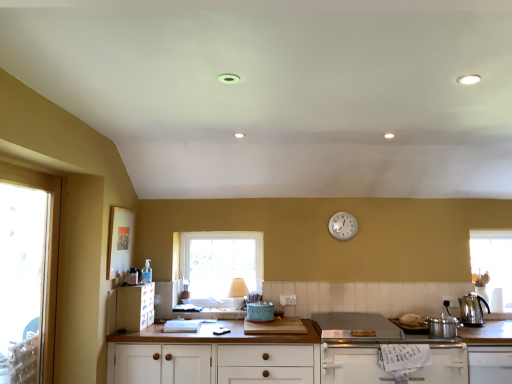
Question: Is teal ceramic toaster at center, which is counted as the first appliance, starting from the back, at the left side of matte plastic cabinet at lower left, the first cabinetry positioned from the left?

Choices:
 (A) no
 (B) yes

Answer: (A)

Question: Considering the relative sizes of teal ceramic toaster at center, the 2th appliance in the right-to-left sequence, and matte plastic cabinet at lower left, marked as the 4th cabinetry in a right-to-left arrangement, in the image provided, is teal ceramic toaster at center, the 2th appliance in the right-to-left sequence, smaller than matte plastic cabinet at lower left, marked as the 4th cabinetry in a right-to-left arrangement,?

Choices:
 (A) yes
 (B) no

Answer: (A)

Question: Does teal ceramic toaster at center, the 2th appliance in the right-to-left sequence, have a larger size compared to matte plastic cabinet at lower left, the first cabinetry positioned from the left?

Choices:
 (A) yes
 (B) no

Answer: (B)

Question: Does teal ceramic toaster at center, the 2th appliance from the front, have a lesser height compared to matte plastic cabinet at lower left, the first cabinetry positioned from the left?

Choices:
 (A) no
 (B) yes

Answer: (B)

Question: Does teal ceramic toaster at center, the 2th appliance in the right-to-left sequence, have a lesser width compared to matte plastic cabinet at lower left, marked as the 4th cabinetry in a right-to-left arrangement?

Choices:
 (A) yes
 (B) no

Answer: (B)

Question: Does teal ceramic toaster at center, which is the first appliance in left-to-right order, have a greater width compared to matte plastic cabinet at lower left, marked as the 4th cabinetry in a right-to-left arrangement?

Choices:
 (A) no
 (B) yes

Answer: (B)

Question: From a real-world perspective, does teal ceramic toaster at center, which is the first appliance in left-to-right order, stand above transparent glass window at left, the 1th window when ordered from left to right?

Choices:
 (A) yes
 (B) no

Answer: (B)

Question: From the image's perspective, is teal ceramic toaster at center, the 2th appliance from the front, under transparent glass window at left, arranged as the 2th window when viewed from the right?

Choices:
 (A) yes
 (B) no

Answer: (A)

Question: Does teal ceramic toaster at center, the 2th appliance in the right-to-left sequence, have a lesser width compared to transparent glass window at left, the 2th window positioned from the back?

Choices:
 (A) no
 (B) yes

Answer: (A)

Question: Can you confirm if teal ceramic toaster at center, the 2th appliance from the front, is positioned to the left of transparent glass window at left, which is the 1th window in front-to-back order?

Choices:
 (A) yes
 (B) no

Answer: (B)

Question: Considering the relative sizes of teal ceramic toaster at center, the 2th appliance from the front, and transparent glass window at left, the 2th window positioned from the back, in the image provided, is teal ceramic toaster at center, the 2th appliance from the front, smaller than transparent glass window at left, the 2th window positioned from the back,?

Choices:
 (A) yes
 (B) no

Answer: (A)

Question: Is teal ceramic toaster at center, the 2th appliance in the right-to-left sequence, beside transparent glass window at left, the 1th window when ordered from left to right?

Choices:
 (A) no
 (B) yes

Answer: (A)

Question: Considering the relative positions of metallic silver pot at right, which ranks as the 1th appliance in front-to-back order, and transparent glass window at left, the 2th window positioned from the back, in the image provided, is metallic silver pot at right, which ranks as the 1th appliance in front-to-back order, behind transparent glass window at left, the 2th window positioned from the back,?

Choices:
 (A) yes
 (B) no

Answer: (A)